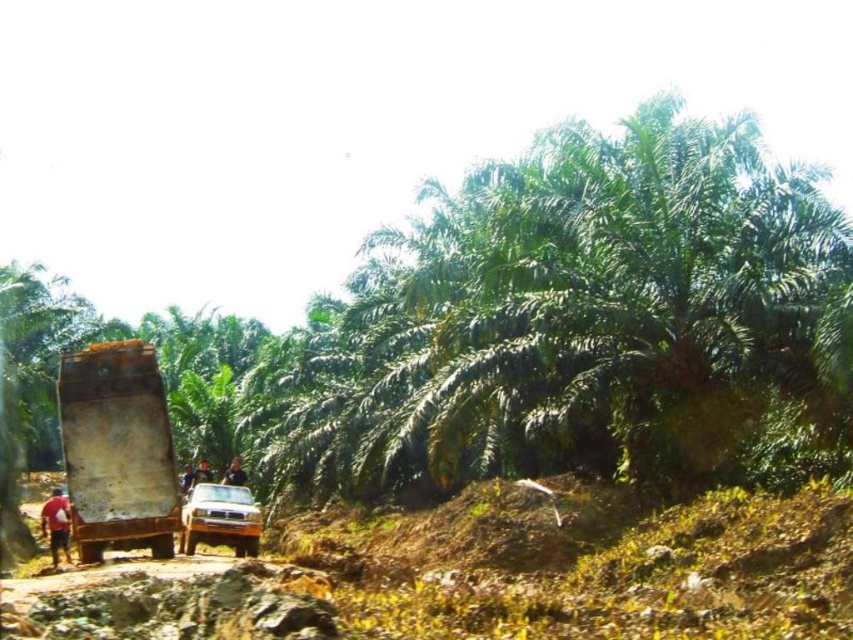
You are a delivery driver who needs to park your truck near the metallic silver suv at center and the dark blue shirt at center. Given the distance between them is 11.33 meters, can you fit your truck that is 6 meters long between them without overlapping either?

The distance between the metallic silver suv at center and the dark blue shirt at center is 11.33 meters. Since your truck is 6 meters long, there is enough space to park between them without overlapping either object.